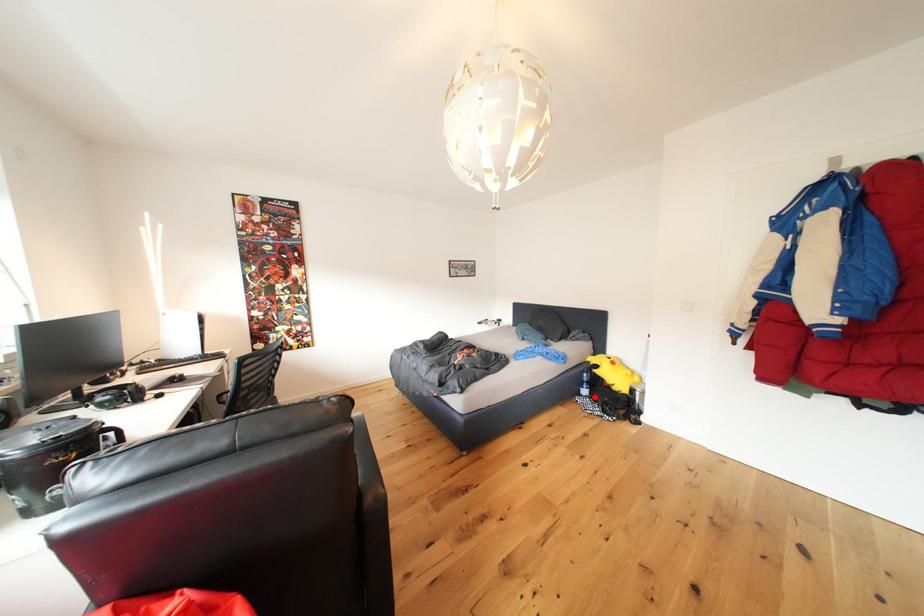
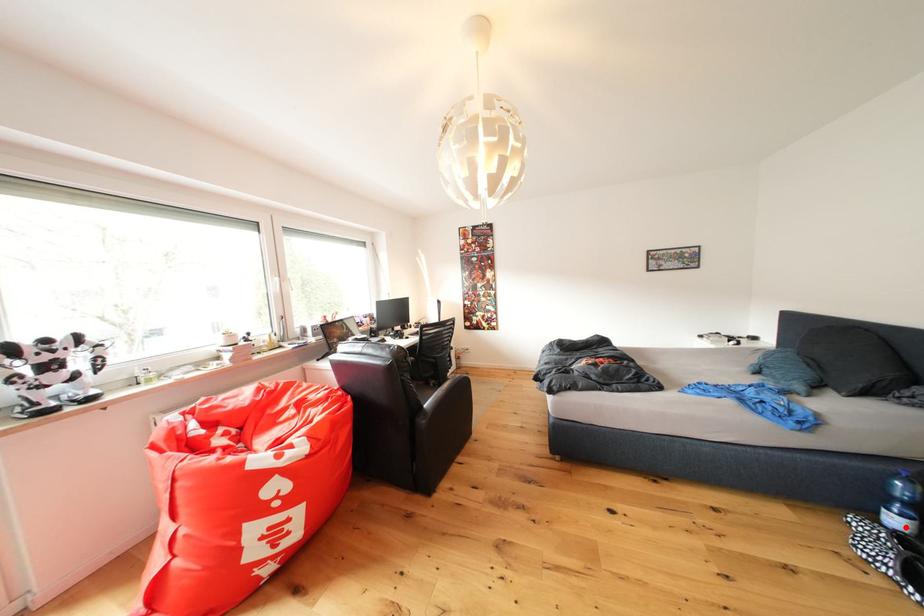
I am providing you with two images of the same scene from different viewpoints. A red point is marked on the first image and another point is marked on the second image. Are the points marked in image1 and image2 representing the same 3D position?

Yes